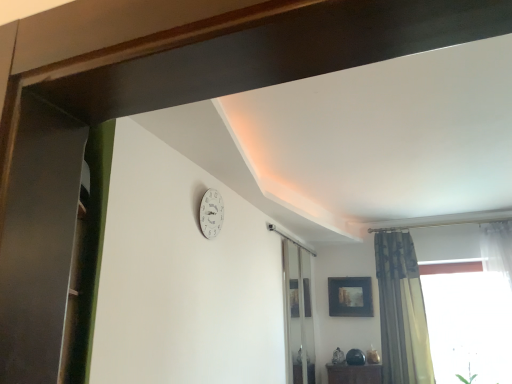
Question: Is point (387, 307) positioned closer to the camera than point (345, 302)?

Choices:
 (A) closer
 (B) farther

Answer: (A)

Question: From a real-world perspective, is textured beige curtain at right above or below matte black picture frame at upper center?

Choices:
 (A) above
 (B) below

Answer: (B)

Question: Estimate the real-world distances between objects in this image. Which object is closer to the transparent glass screen door at center, which is the first screen door from bottom to top?

Choices:
 (A) transparent glass screen door at left, acting as the 2th screen door starting from the back
 (B) textured beige curtain at right
 (C) matte black picture frame at upper center
 (D) white matte clock at upper center

Answer: (C)

Question: Which of these objects is positioned farthest from the transparent glass screen door at left, the 1th screen door positioned from the front?

Choices:
 (A) matte black picture frame at upper center
 (B) textured beige curtain at right
 (C) transparent glass screen door at center, the 1th screen door from the right
 (D) white matte clock at upper center

Answer: (A)